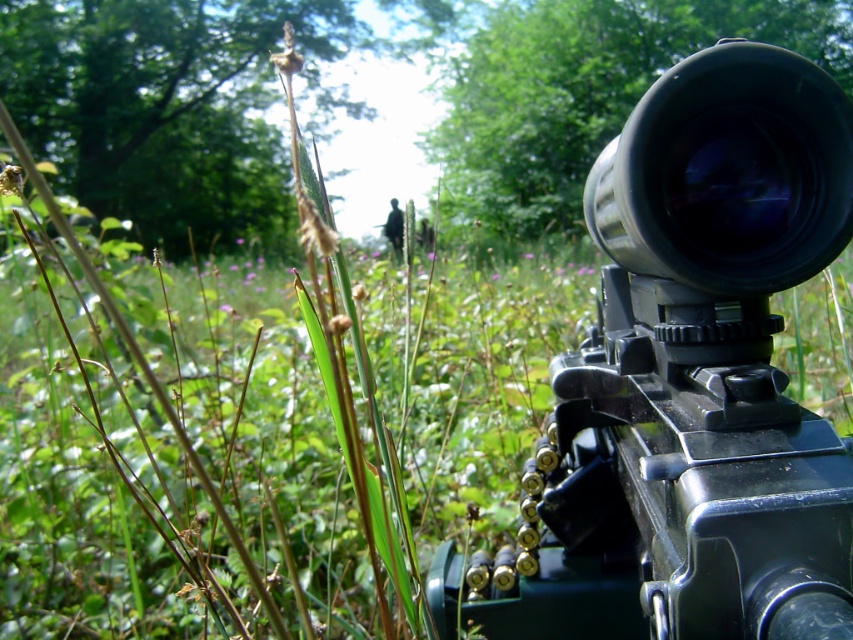
Can you confirm if matte black rifle at center is positioned to the right of black matte lens at upper right?

No, matte black rifle at center is not to the right of black matte lens at upper right.

Who is taller, matte black rifle at center or black matte lens at upper right?

With more height is matte black rifle at center.

Does point (660, 240) come farther from viewer compared to point (593, 221)?

No, (660, 240) is in front of (593, 221).

Locate an element on the screen. matte black rifle at center is located at coordinates (688, 381).